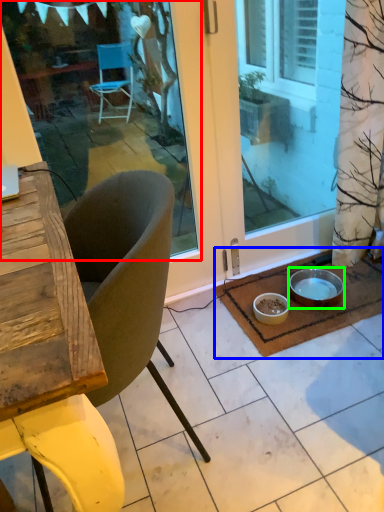
Question: Which is nearer to the window screen (highlighted by a red box)? doormat (highlighted by a blue box) or bowl (highlighted by a green box).

Choices:
 (A) doormat
 (B) bowl

Answer: (A)